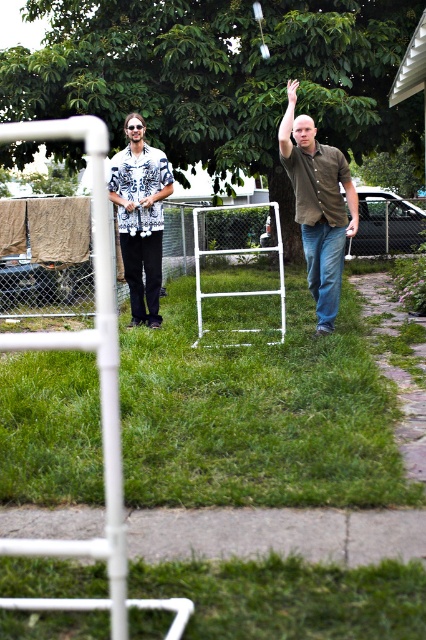
Does white metal fence at center have a lesser height compared to brown matte shirt at center?

No.

Is point (86, 276) in front of point (313, 193)?

That is False.

The height and width of the screenshot is (640, 426). I want to click on white metal fence at center, so click(43, 284).

Who is more forward, (42, 579) or (397, 209)?

Point (42, 579) is more forward.

The width and height of the screenshot is (426, 640). I want to click on green grass at lower center, so click(290, 596).

At what (x,y) coordinates should I click in order to perform the action: click on green grass at lower center. Please return your answer as a coordinate pair (x, y). The image size is (426, 640). Looking at the image, I should click on (290, 596).

Locate an element on the screen. This screenshot has width=426, height=640. green grass at center is located at coordinates (x=259, y=413).

Is point (172, 317) positioned in front of point (23, 314)?

Yes, point (172, 317) is in front of point (23, 314).

The image size is (426, 640). Identify the location of green grass at center. (259, 413).